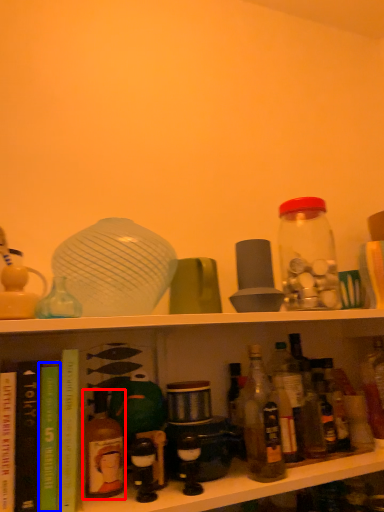
Question: Which point is further to the camera, bottle (highlighted by a red box) or book (highlighted by a blue box)?

Choices:
 (A) bottle
 (B) book

Answer: (A)